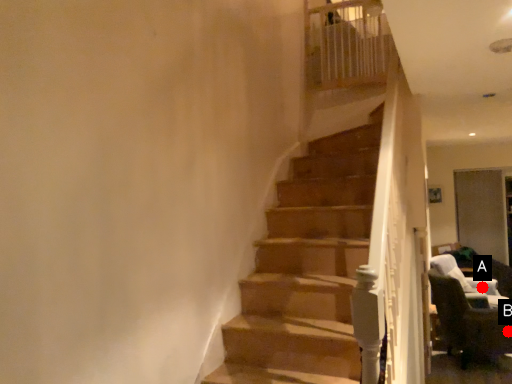
Question: Two points are circled on the image, labeled by A and B beside each circle. Which point is closer to the camera?

Choices:
 (A) A is closer
 (B) B is closer

Answer: (B)